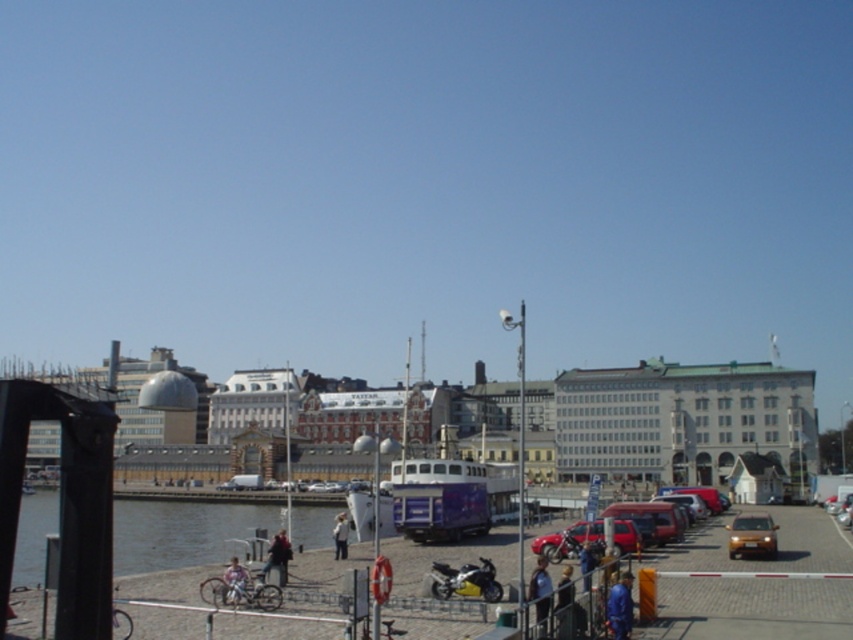
You are a photographer trying to capture a photo of both the blue fabric jacket at lower center and the dark brown leather jacket at lower center in the same frame. Based on their positions, which jacket should you adjust your camera angle to focus on first to ensure both are in the shot?

The blue fabric jacket at lower center is to the right of the dark brown leather jacket at lower center, so you should focus on the dark brown leather jacket at lower center first to ensure both are within the frame.